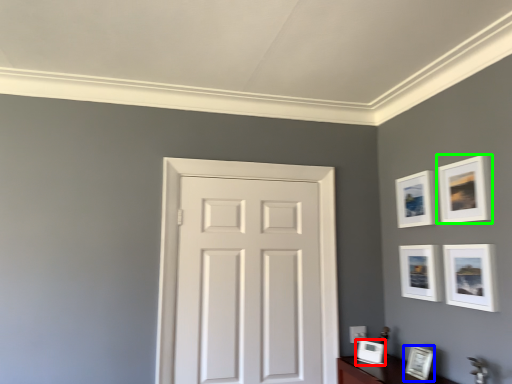
Question: Based on their relative distances, which object is farther from picture frame (highlighted by a red box)? Choose from picture frame (highlighted by a blue box) and picture frame (highlighted by a green box).

Choices:
 (A) picture frame
 (B) picture frame

Answer: (B)